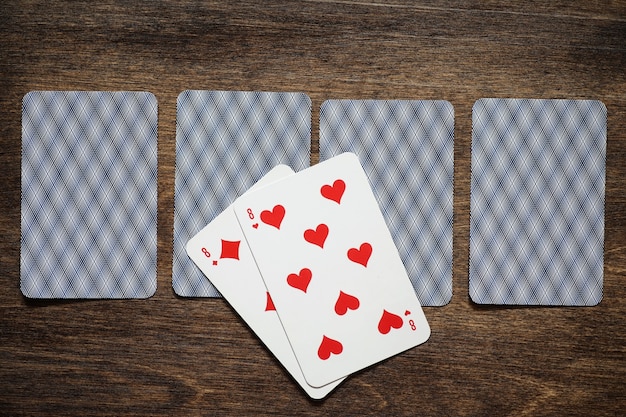
Locate an element on the screen. This screenshot has height=417, width=626. playing cards is located at coordinates (91, 192), (223, 170), (393, 168), (546, 181), (330, 261), (250, 269).